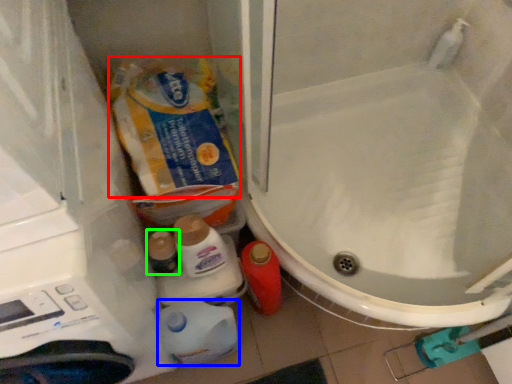
Question: Which object is positioned farthest from product (highlighted by a red box)? Select from cleaning product (highlighted by a blue box) and toiletry (highlighted by a green box).

Choices:
 (A) cleaning product
 (B) toiletry

Answer: (A)